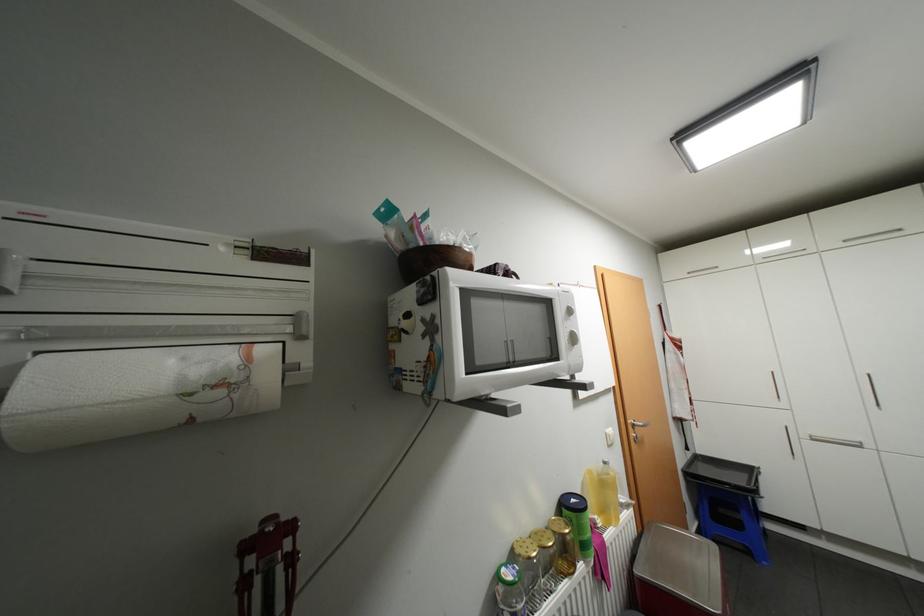
Identify the location of green lidded canister. (578, 522).